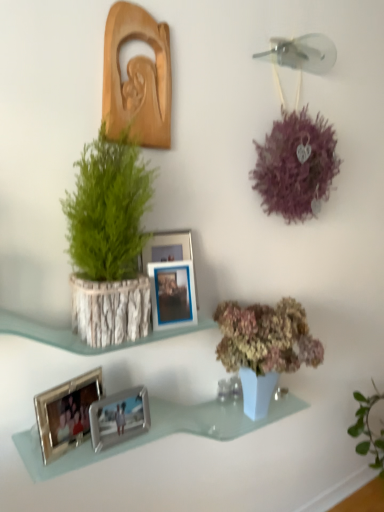
Question: From a real-world perspective, is silver metallic photo frame at lower left, which appears as the 4th picture frame when viewed from the top, on top of silver metallic photo frame at lower center, the 5th picture frame in the top-to-bottom sequence?

Choices:
 (A) no
 (B) yes

Answer: (B)

Question: Is silver metallic photo frame at lower center, marked as the 1th picture frame in a bottom-to-top arrangement, at the back of silver metallic photo frame at lower left, which appears as the 4th picture frame when viewed from the top?

Choices:
 (A) yes
 (B) no

Answer: (B)

Question: Does silver metallic photo frame at lower left, the second picture frame positioned from the bottom, have a greater height compared to silver metallic photo frame at lower center, the 5th picture frame in the top-to-bottom sequence?

Choices:
 (A) yes
 (B) no

Answer: (A)

Question: Is silver metallic photo frame at lower left, which appears as the 4th picture frame when viewed from the top, far away from silver metallic photo frame at lower center, marked as the 1th picture frame in a bottom-to-top arrangement?

Choices:
 (A) yes
 (B) no

Answer: (B)

Question: Is silver metallic photo frame at lower left, the second picture frame positioned from the bottom, at the right side of silver metallic photo frame at lower center, marked as the 1th picture frame in a bottom-to-top arrangement?

Choices:
 (A) yes
 (B) no

Answer: (B)

Question: Visually, is blue metallic picture frame at center, which is the 3th picture frame in top-to-bottom order, positioned to the left or to the right of metallic silver photo frame at center, the fourth picture frame in the bottom-to-top sequence?

Choices:
 (A) left
 (B) right

Answer: (B)

Question: Considering the positions of blue metallic picture frame at center, the third picture frame when ordered from bottom to top, and metallic silver photo frame at center, which appears as the second picture frame when viewed from the top, in the image, is blue metallic picture frame at center, the third picture frame when ordered from bottom to top, taller or shorter than metallic silver photo frame at center, which appears as the second picture frame when viewed from the top,?

Choices:
 (A) short
 (B) tall

Answer: (A)

Question: Looking at the image, does blue metallic picture frame at center, which is the 3th picture frame in top-to-bottom order, seem bigger or smaller compared to metallic silver photo frame at center, the fourth picture frame in the bottom-to-top sequence?

Choices:
 (A) small
 (B) big

Answer: (A)

Question: Is blue metallic picture frame at center, which is the 3th picture frame in top-to-bottom order, in front of or behind metallic silver photo frame at center, which appears as the second picture frame when viewed from the top, in the image?

Choices:
 (A) front
 (B) behind

Answer: (A)

Question: Which is correct: wooden carving at upper left, the 5th picture frame in the bottom-to-top sequence, is inside silver metallic photo frame at lower center, marked as the 1th picture frame in a bottom-to-top arrangement, or outside of it?

Choices:
 (A) outside
 (B) inside

Answer: (A)

Question: Considering the relative positions of wooden carving at upper left, the 5th picture frame in the bottom-to-top sequence, and silver metallic photo frame at lower center, marked as the 1th picture frame in a bottom-to-top arrangement, in the image provided, is wooden carving at upper left, the 5th picture frame in the bottom-to-top sequence, to the left or to the right of silver metallic photo frame at lower center, marked as the 1th picture frame in a bottom-to-top arrangement,?

Choices:
 (A) left
 (B) right

Answer: (B)

Question: From the image's perspective, is wooden carving at upper left, the 5th picture frame in the bottom-to-top sequence, located above or below silver metallic photo frame at lower center, marked as the 1th picture frame in a bottom-to-top arrangement?

Choices:
 (A) below
 (B) above

Answer: (B)

Question: From their relative heights in the image, would you say wooden carving at upper left, the 5th picture frame in the bottom-to-top sequence, is taller or shorter than silver metallic photo frame at lower center, marked as the 1th picture frame in a bottom-to-top arrangement?

Choices:
 (A) short
 (B) tall

Answer: (B)

Question: Considering the positions of silver metallic photo frame at lower left, which appears as the 4th picture frame when viewed from the top, and blue metallic picture frame at center, the third picture frame when ordered from bottom to top, in the image, is silver metallic photo frame at lower left, which appears as the 4th picture frame when viewed from the top, taller or shorter than blue metallic picture frame at center, the third picture frame when ordered from bottom to top,?

Choices:
 (A) tall
 (B) short

Answer: (B)

Question: In terms of size, does silver metallic photo frame at lower left, the second picture frame positioned from the bottom, appear bigger or smaller than blue metallic picture frame at center, the third picture frame when ordered from bottom to top?

Choices:
 (A) big
 (B) small

Answer: (B)